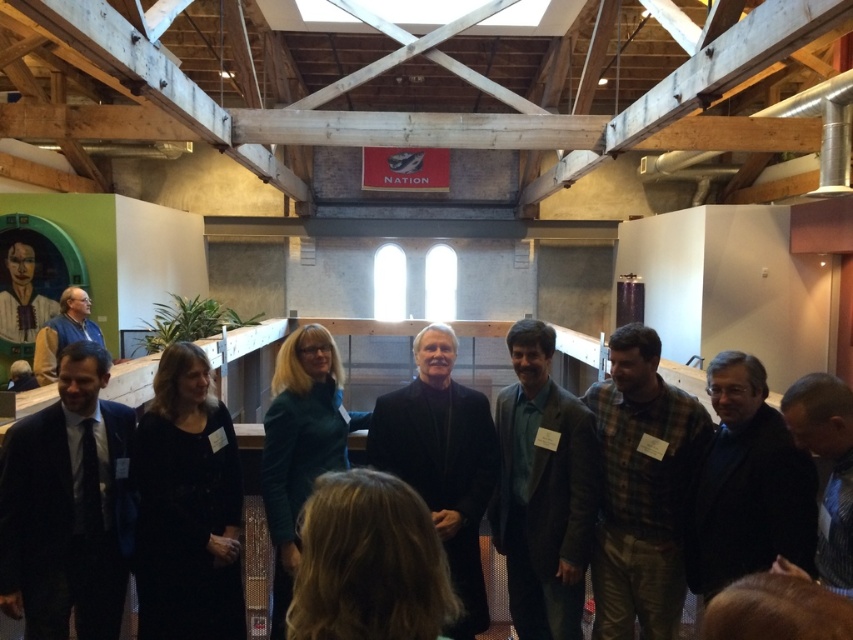
Consider the image. Can you confirm if green matte sweater at center is positioned below blue striped tie at center?

Yes, green matte sweater at center is below blue striped tie at center.

What do you see at coordinates (300, 444) in the screenshot?
I see `green matte sweater at center` at bounding box center [300, 444].

Where is `green matte sweater at center`? Image resolution: width=853 pixels, height=640 pixels. green matte sweater at center is located at coordinates (300, 444).

Is point (637, 624) more distant than point (416, 397)?

Yes, it is.

Does plaid fabric shirt at center come in front of black matte suit at center?

No, it is not.

This screenshot has height=640, width=853. What do you see at coordinates (642, 488) in the screenshot?
I see `plaid fabric shirt at center` at bounding box center [642, 488].

You are a GUI agent. You are given a task and a screenshot of the screen. Output one action in this format:
    pyautogui.click(x=<x>, y=<y>)
    Task: Click on the plaid fabric shirt at center
    The height and width of the screenshot is (640, 853).
    Given the screenshot: What is the action you would take?
    pyautogui.click(x=642, y=488)

Does point (77, 532) come closer to viewer compared to point (329, 468)?

Yes.

Looking at this image, who is more distant from viewer, (82, 456) or (294, 449)?

The point (294, 449) is behind.

Image resolution: width=853 pixels, height=640 pixels. Describe the element at coordinates (67, 506) in the screenshot. I see `satin black suit at left` at that location.

Where is `satin black suit at left`? satin black suit at left is located at coordinates (67, 506).